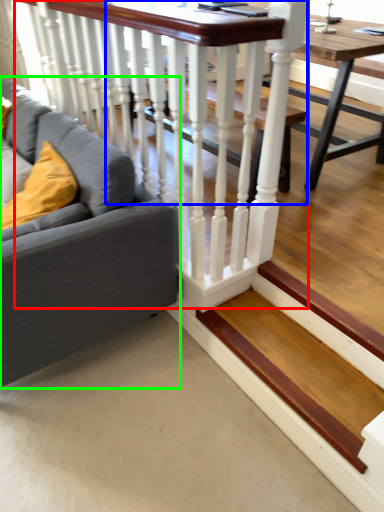
Question: Based on their relative distances, which object is farther from rail (highlighted by a red box)? Choose from table (highlighted by a blue box) and studio couch (highlighted by a green box).

Choices:
 (A) table
 (B) studio couch

Answer: (A)